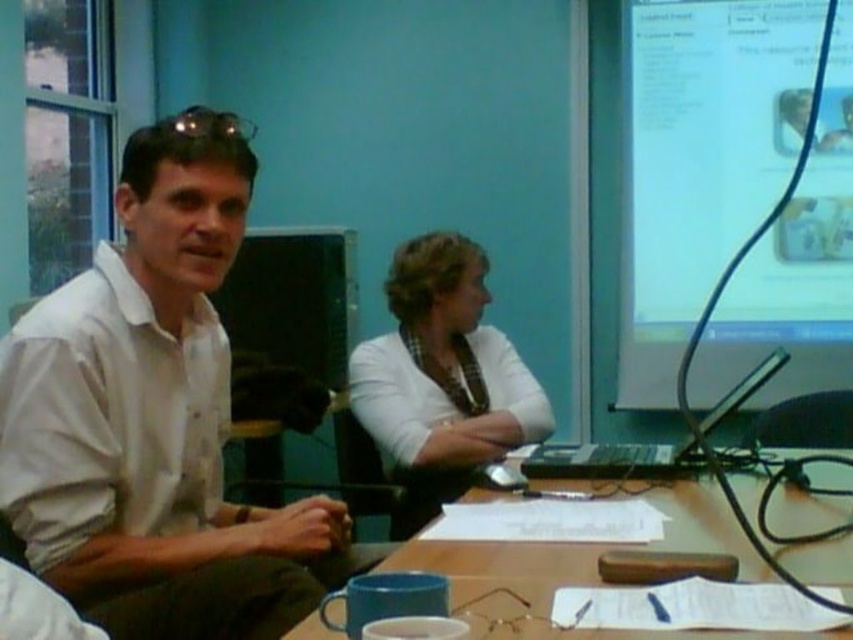
You are standing in the room and want to project a presentation onto the matte plastic projector screen at upper right. The projector is located at point (700, 160). Is the projector positioned correctly to project onto the screen?

The point (700, 160) is on the matte plastic projector screen at upper right, so the projector is positioned correctly to project onto the screen.

You are standing in the room and want to reach both points. Which point should you reach first, point (x=784, y=484) or point (x=706, y=433)?

You should reach point (x=784, y=484) first because it is closer to you than point (x=706, y=433).

You are organizing a small event and need to place a 1.2 meter long banner on the wooden table at center. Can the banner fit on the table without overlapping the black plastic computer at center?

The wooden table at center has a larger size compared to black plastic computer at center. Since the table is bigger, the 1.2 meter banner can fit without overlapping the computer as long as it is placed appropriately.